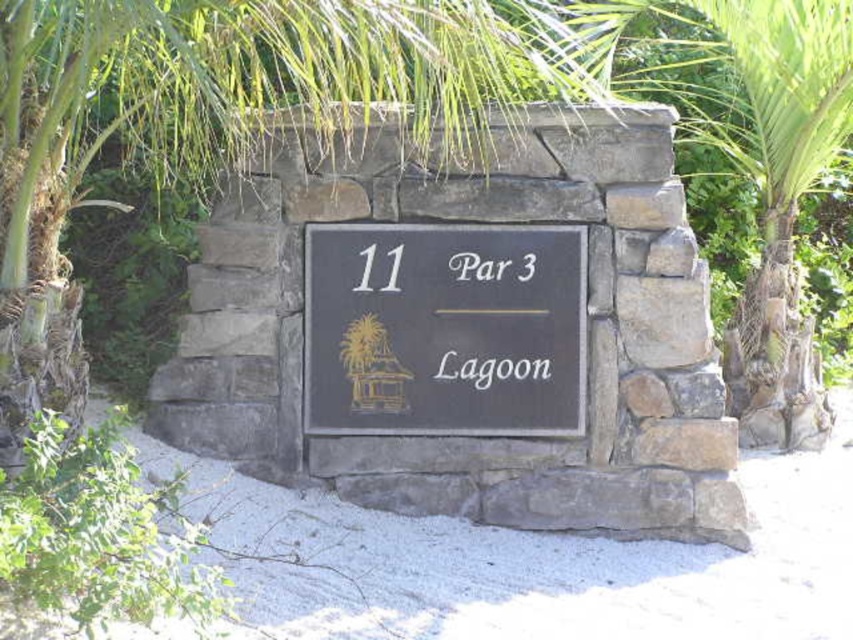
You are a landscape architect designing a pathway around the stone structure with the black slate sign at center and the black matte sign at center. Which sign should you place a taller plant next to to ensure it doesn

The black slate sign at center has a greater height compared to the black matte sign at center, so you should place a taller plant next to the black slate sign at center to ensure proper proportion and balance in the design.

You are a photographer trying to capture the black matte sign at center without any obstructions. There is a green leafy palm tree at upper center in the scene. Which object should you move or adjust to achieve an unobstructed view of the sign?

The green leafy palm tree at upper center is in front of the black matte sign at center, so you should move or adjust the green leafy palm tree at upper center to get an unobstructed view of the sign.